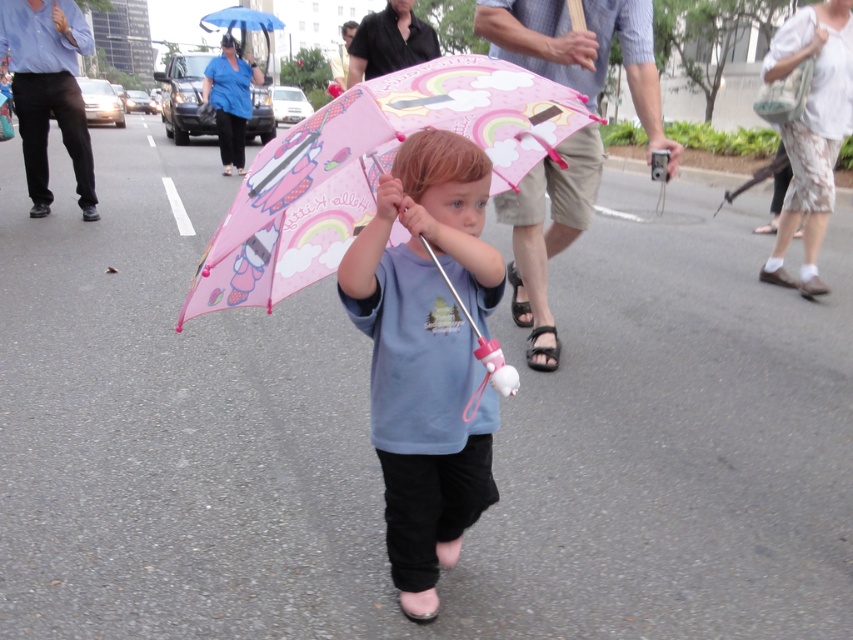
Question: Based on their relative distances, which object is nearer to the pink matte umbrella at center?

Choices:
 (A) matte pink umbrella at center
 (B) pink fabric umbrella at upper center
 (C) white fabric bag at upper right

Answer: (A)

Question: Can you confirm if pink matte umbrella at center is positioned below white fabric bag at upper right?

Choices:
 (A) no
 (B) yes

Answer: (B)

Question: Among these points, which one is nearest to the camera?

Choices:
 (A) (380, 323)
 (B) (577, 124)

Answer: (A)

Question: Which point is closer to the camera?

Choices:
 (A) pink fabric umbrella at upper center
 (B) matte pink umbrella at center
 (C) white fabric bag at upper right

Answer: (B)

Question: Does pink matte umbrella at center appear over white fabric bag at upper right?

Choices:
 (A) yes
 (B) no

Answer: (B)

Question: Does matte pink umbrella at center have a greater width compared to pink matte umbrella at center?

Choices:
 (A) no
 (B) yes

Answer: (A)